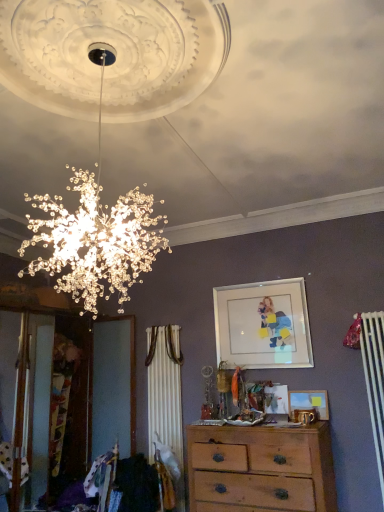
Question: Is wooden chest of drawers at center inside the boundaries of matte glass picture frame at upper center, which is the first picture frame from top to bottom, or outside?

Choices:
 (A) outside
 (B) inside

Answer: (A)

Question: Considering their positions, is wooden chest of drawers at center located in front of or behind matte glass picture frame at upper center, which is the second picture frame from bottom to top?

Choices:
 (A) front
 (B) behind

Answer: (A)

Question: Based on their relative distances, which object is farther from the matte wooden picture frame at center, placed as the first picture frame when sorted from bottom to top?

Choices:
 (A) wooden chest of drawers at center
 (B) matte glass picture frame at upper center, which is the first picture frame from top to bottom

Answer: (A)

Question: Which is nearer to the matte wooden picture frame at center, acting as the 2th picture frame starting from the top?

Choices:
 (A) wooden chest of drawers at center
 (B) matte glass picture frame at upper center, which is the second picture frame from bottom to top

Answer: (B)